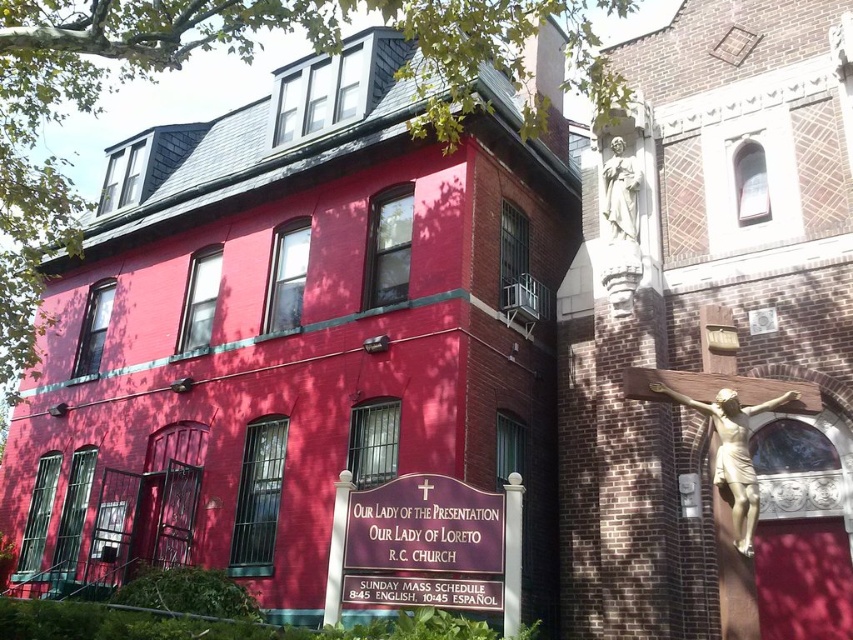
You are a delivery person needing to place a package between the gold metallic crucifix at right and the white marble statue at upper right. The package requires 3 meters of space. Is there enough space between them?

The gold metallic crucifix at right is 4.13 meters away from the white marble statue at upper right, so yes, there is enough space to place the package between them since the distance is greater than the required 3 meters.

Based on the scene description, which object is larger when viewed from the front of the building? The gold statue of jesus at center or the gold metallic crucifix at right?

The gold metallic crucifix at right is larger than the gold statue of jesus at center when viewed from the front of the building.